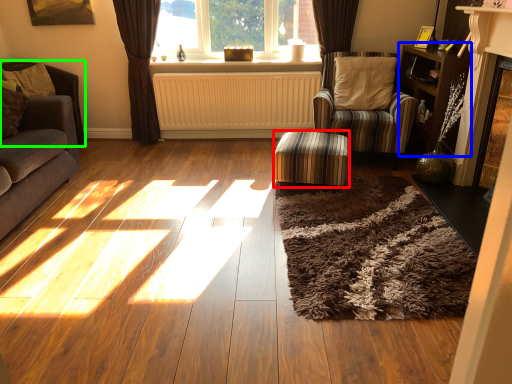
Question: Which is farther away from stool (highlighted by a red box)? bookshelf (highlighted by a blue box) or armchair (highlighted by a green box)?

Choices:
 (A) bookshelf
 (B) armchair

Answer: (B)